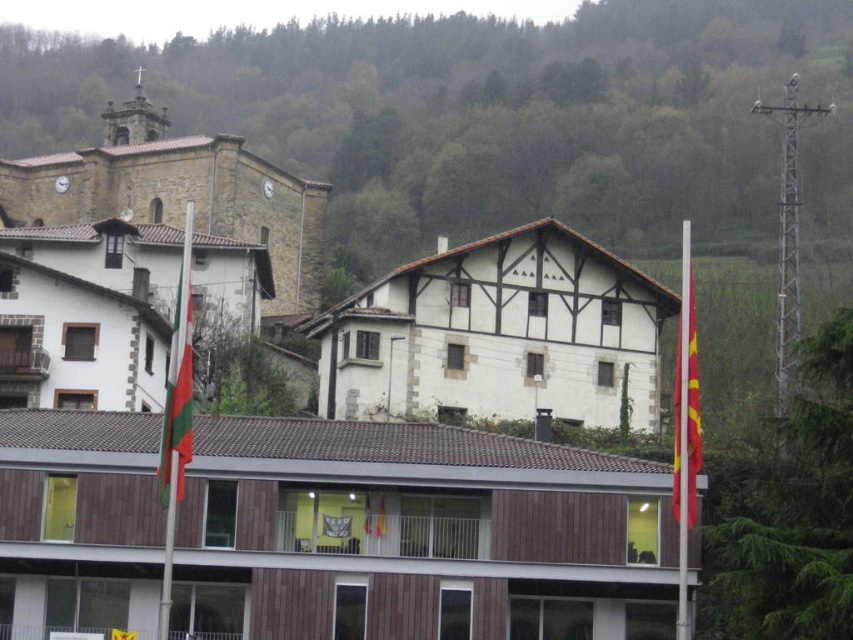
In the scene shown: Who is higher up, white wood hotel at upper left or green and white striped flag at left?

white wood hotel at upper left

Where is `white wood hotel at upper left`? white wood hotel at upper left is located at coordinates (86, 314).

Between red fabric flag at right and green and white striped flag at left, which one is positioned higher?

red fabric flag at right is higher up.

Who is shorter, red fabric flag at right or green and white striped flag at left?

Standing shorter between the two is green and white striped flag at left.

Does point (683, 416) come farther from viewer compared to point (181, 333)?

No.

The height and width of the screenshot is (640, 853). Find the location of `red fabric flag at right`. red fabric flag at right is located at coordinates (686, 410).

Describe the element at coordinates (416, 536) in the screenshot. I see `brown wooden building at center` at that location.

Which is above, brown wooden building at center or white wood house at center?

white wood house at center is above.

Which is behind, point (142, 564) or point (351, 394)?

Positioned behind is point (351, 394).

In order to click on brown wooden building at center in this screenshot , I will do `click(416, 536)`.